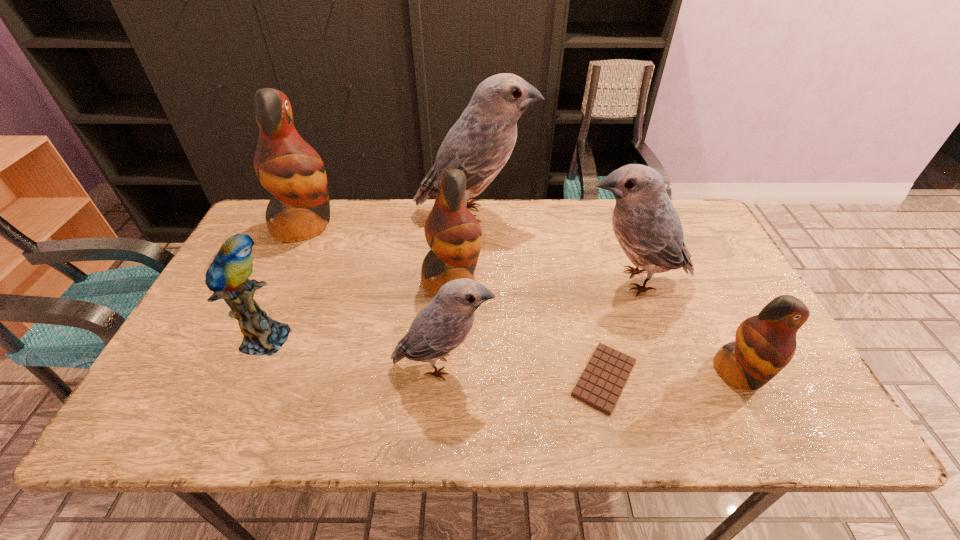
The height and width of the screenshot is (540, 960). I want to click on free region located 0.230m on the right of the brown chocolate bar, so click(741, 378).

Locate an element on the screen. This screenshot has height=540, width=960. object present at the near edge is located at coordinates (x=605, y=375).

In order to click on object at the far left corner in this screenshot , I will do `click(286, 165)`.

Find the location of `vacant region at the far edge of the desktop`. vacant region at the far edge of the desktop is located at coordinates (571, 216).

Locate an element on the screen. vacant space at the near edge of the desktop is located at coordinates (223, 432).

Find the location of a particular element. blank area at the right edge is located at coordinates [x=692, y=251].

Locate an element on the screen. Image resolution: width=960 pixels, height=540 pixels. vacant space at the near left corner of the desktop is located at coordinates (161, 413).

At what (x,y) coordinates should I click in order to perform the action: click on free space at the far right corner of the desktop. Please return your answer as a coordinate pair (x, y). The width and height of the screenshot is (960, 540). Looking at the image, I should click on (702, 219).

Where is `vacant space at the near right corner of the desktop`? vacant space at the near right corner of the desktop is located at coordinates (806, 410).

You are a GUI agent. You are given a task and a screenshot of the screen. Output one action in this format:
    pyautogui.click(x=<x>, y=<y>)
    Task: Click on the free space that is in between the biggest red parrot and the smallest gray parrot
    Image resolution: width=960 pixels, height=540 pixels.
    Given the screenshot: What is the action you would take?
    pyautogui.click(x=373, y=295)